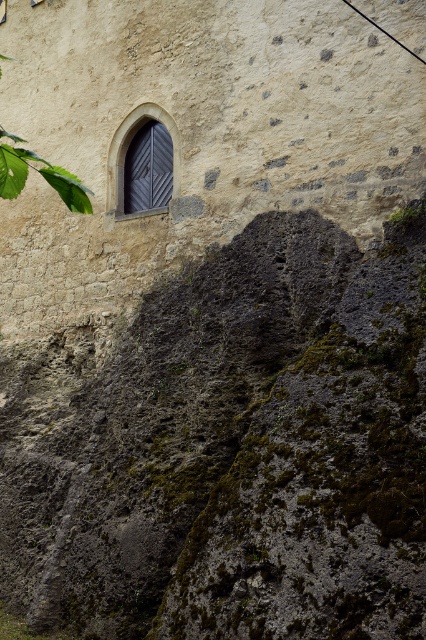
Question: Which object is the closest to the green leafy tree at upper left?

Choices:
 (A) green mossy rock at lower left
 (B) dark gray wood door at upper left

Answer: (B)

Question: Which object appears closest to the camera in this image?

Choices:
 (A) green mossy rock at lower left
 (B) dark gray wood door at upper left

Answer: (A)

Question: Does green mossy rock at lower left come behind dark gray wood door at upper left?

Choices:
 (A) yes
 (B) no

Answer: (B)

Question: Which point is closer to the camera taking this photo?

Choices:
 (A) (158, 116)
 (B) (74, 177)
 (C) (121, 541)

Answer: (B)

Question: Is green leafy tree at upper left above dark gray wood door at upper left?

Choices:
 (A) no
 (B) yes

Answer: (A)

Question: Does green leafy tree at upper left come behind dark gray wood door at upper left?

Choices:
 (A) no
 (B) yes

Answer: (A)